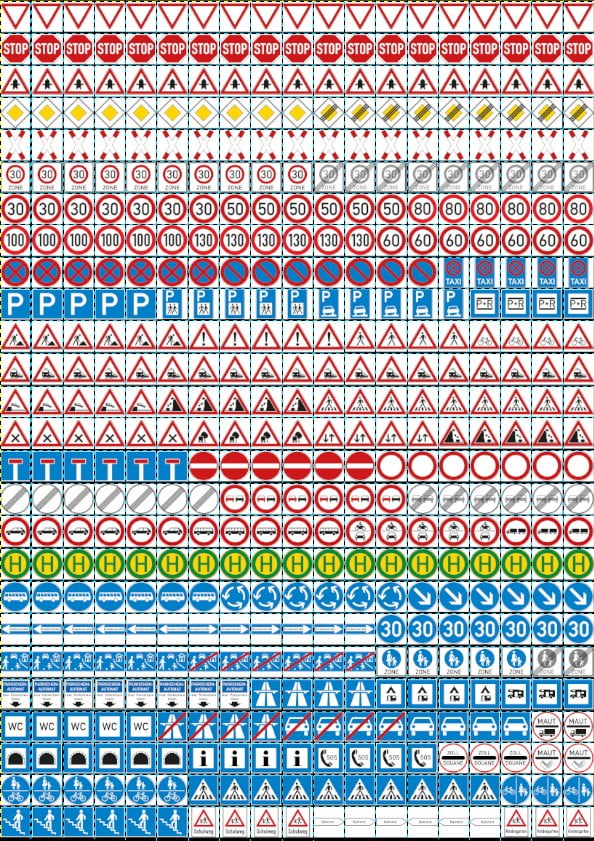
In order to click on stairs in this screenshot , I will do `click(14, 821)`, `click(44, 823)`, `click(72, 823)`, `click(108, 823)`, `click(135, 826)`, `click(170, 823)`.